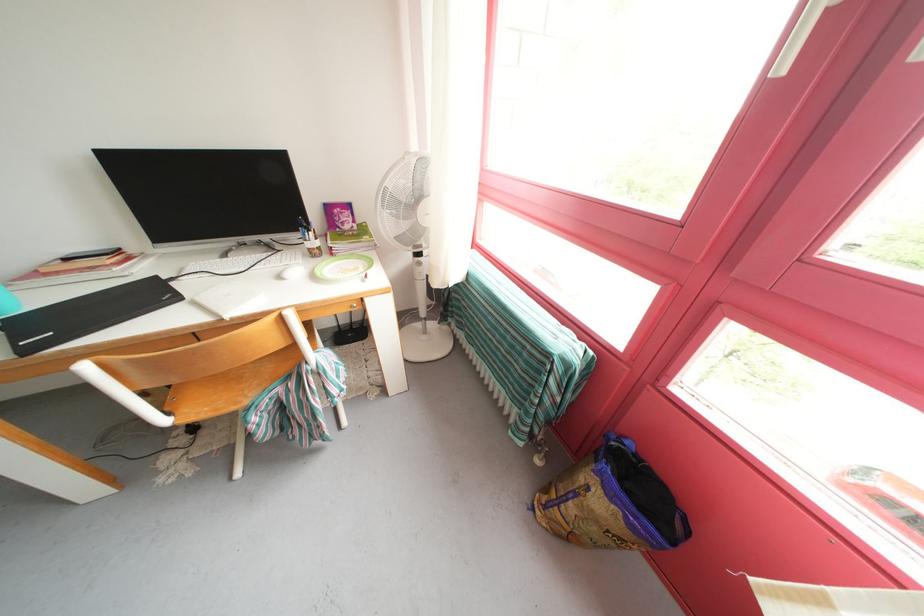
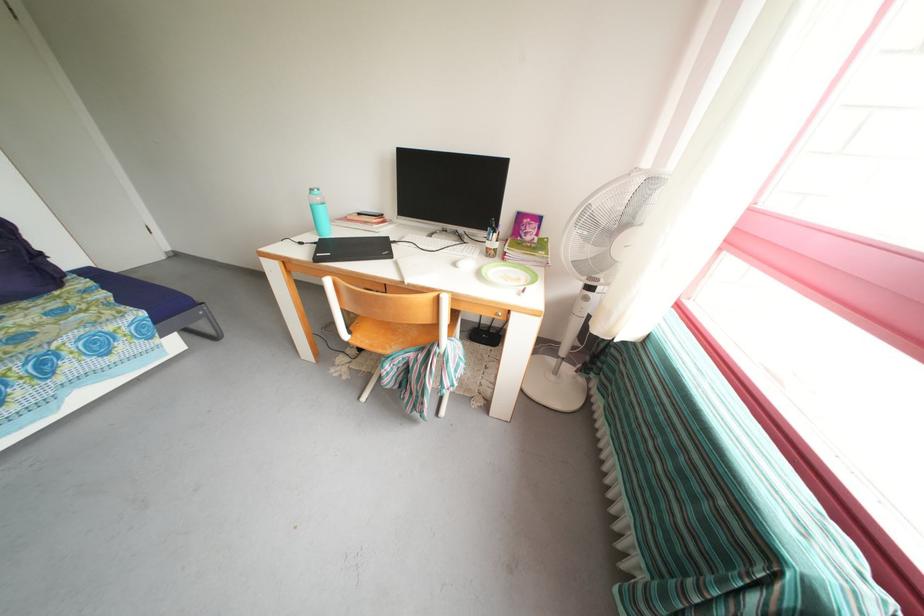
Where in the second image is the point corresponding to (x=349, y=229) from the first image?

(532, 238)